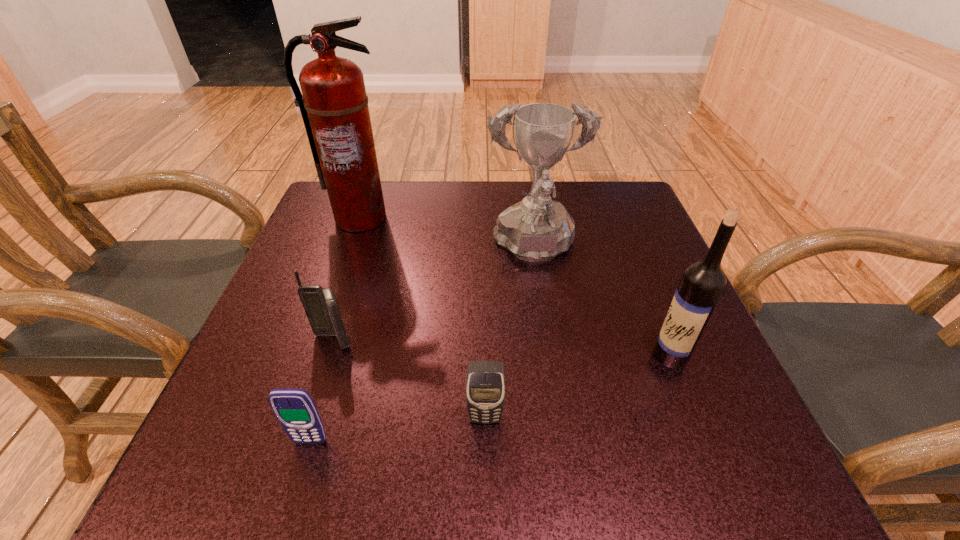
Select which cellular telephone is the second closest to the wine bottle. Please provide its 2D coordinates. Your answer should be formatted as a tuple, i.e. [(x, y)], where the tuple contains the x and y coordinates of a point satisfying the conditions above.

[(320, 305)]

The width and height of the screenshot is (960, 540). In order to click on free spot that satisfies the following two spatial constraints: 1. on the label of the wine bottle; 2. on the front face of the second nearest object in this screenshot , I will do `click(696, 418)`.